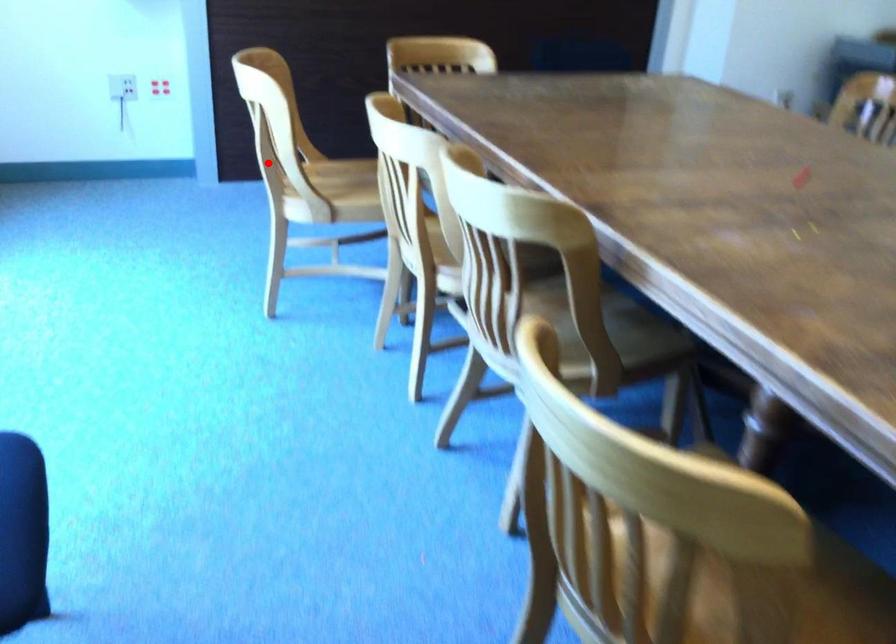
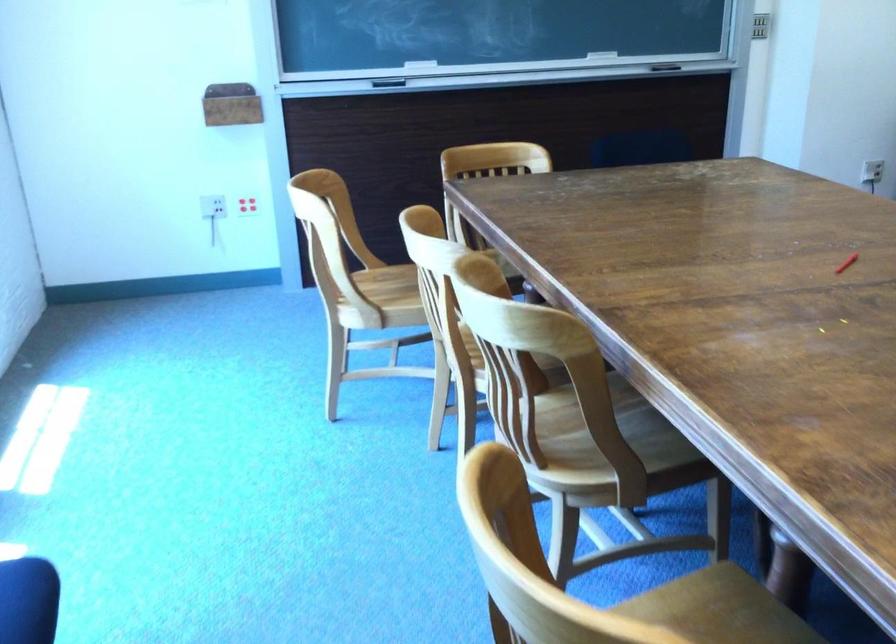
In the second image, find the point that corresponds to the highlighted location in the first image.

(328, 276)